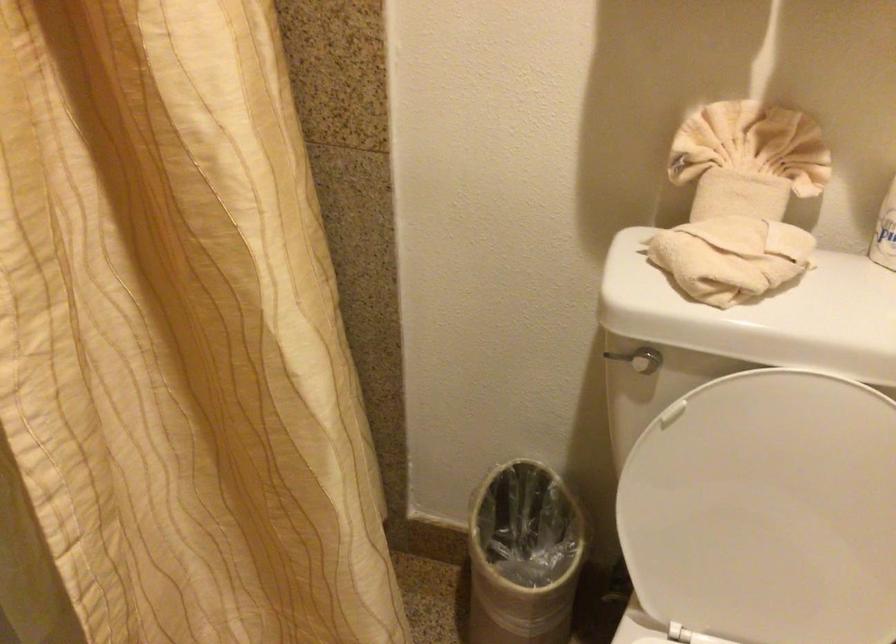
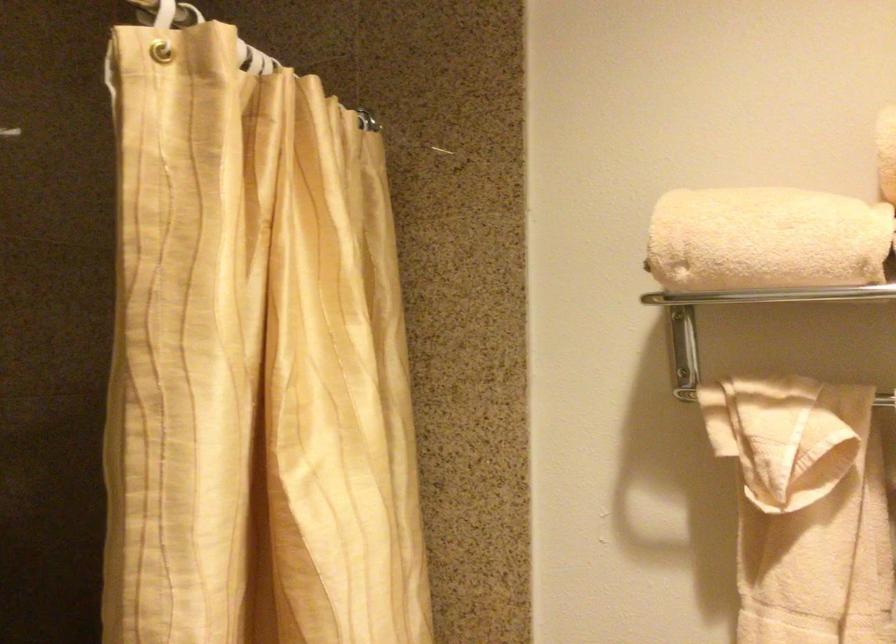
Question: The images are taken continuously from a first-person perspective. In which direction is your viewpoint rotating?

Choices:
 (A) Left
 (B) Right
 (C) Up
 (D) Down

Answer: (C)